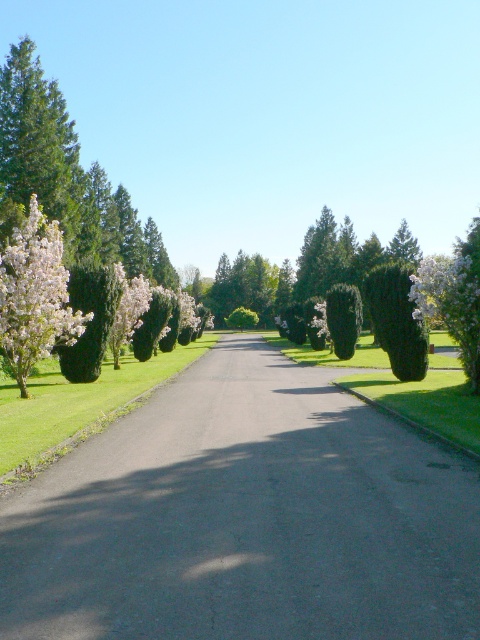
Question: Does fluffy white blossoms at left appear under white fluffy flower at center right?

Choices:
 (A) no
 (B) yes

Answer: (A)

Question: Does white fluffy flower at center right appear on the right side of white fluffy flower at left?

Choices:
 (A) no
 (B) yes

Answer: (B)

Question: Among these objects, which one is farthest from the camera?

Choices:
 (A) white fluffy flower at center right
 (B) white matte flower at center

Answer: (B)

Question: Considering the real-world distances, which object is farthest from the green textured hedge at center-right?

Choices:
 (A) white fluffy flower at left
 (B) fluffy white blossoms at left
 (C) white fluffy flower at center right
 (D) green leafy hedge at left

Answer: (B)

Question: Which of the following is the farthest from the observer?

Choices:
 (A) (328, 298)
 (B) (105, 340)
 (C) (19, 342)
 (D) (117, 342)

Answer: (A)

Question: Is the position of green textured hedge at center-right more distant than that of white fluffy flower at left?

Choices:
 (A) no
 (B) yes

Answer: (B)